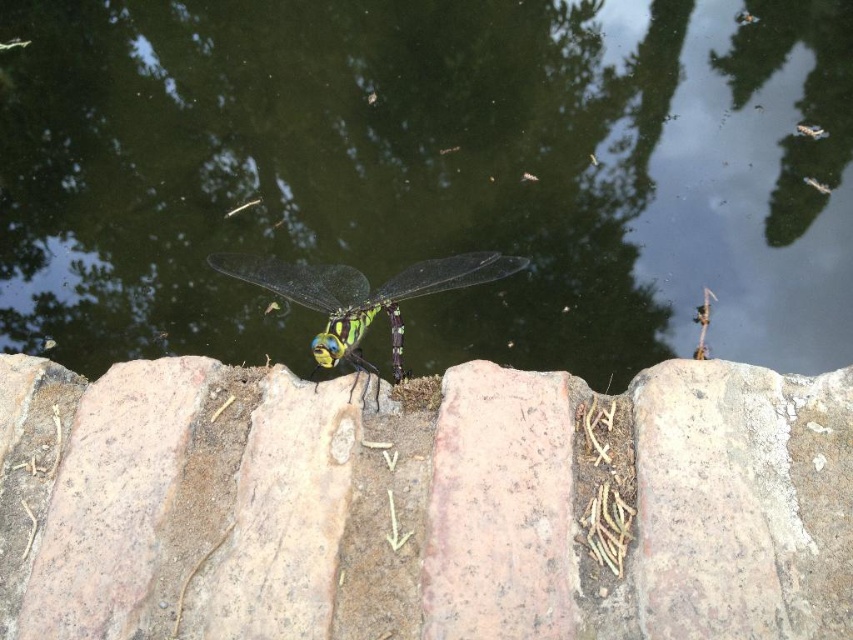
Question: Is greenish water at center below transparent glass dragonfly at center?

Choices:
 (A) no
 (B) yes

Answer: (A)

Question: Can you confirm if greenish water at center is thinner than smooth stone at center?

Choices:
 (A) no
 (B) yes

Answer: (A)

Question: Does smooth stone at center have a greater width compared to transparent glass dragonfly at center?

Choices:
 (A) yes
 (B) no

Answer: (A)

Question: Considering the real-world distances, which object is farthest from the smooth stone at center?

Choices:
 (A) greenish water at center
 (B) transparent glass dragonfly at center

Answer: (A)

Question: Which point is farther to the camera?

Choices:
 (A) (639, 397)
 (B) (491, 211)

Answer: (B)

Question: Considering the real-world distances, which object is closest to the smooth stone at center?

Choices:
 (A) greenish water at center
 (B) transparent glass dragonfly at center

Answer: (B)